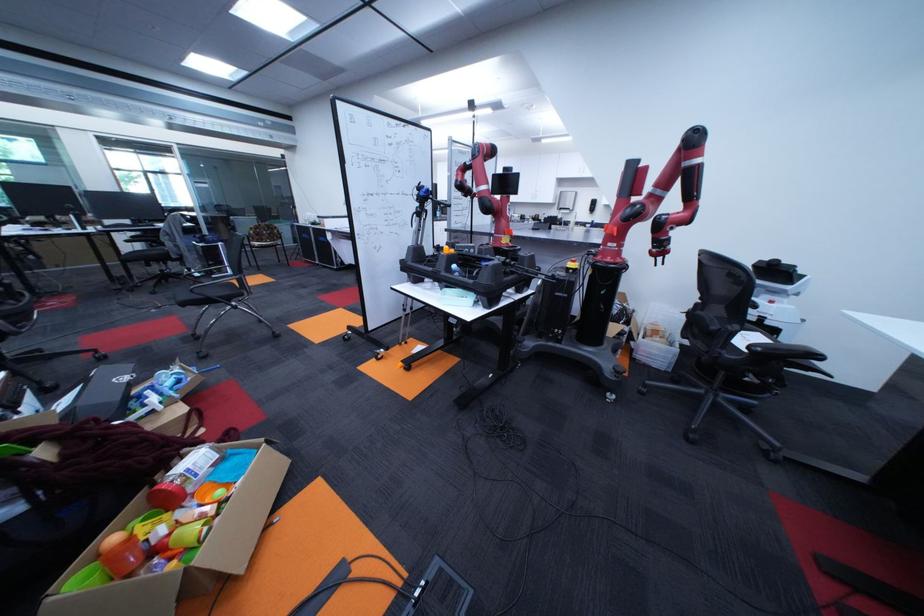
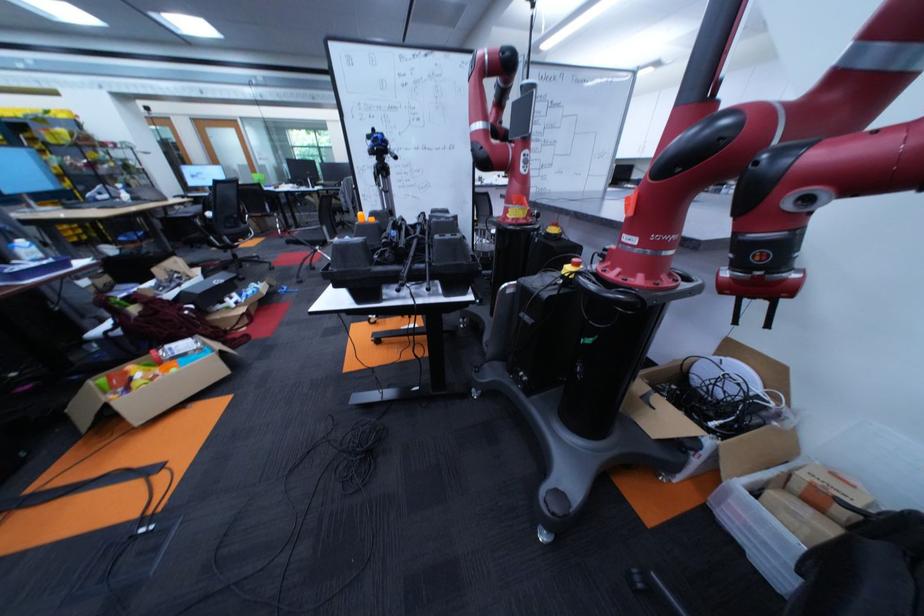
Where in the second image is the point corresponding to (210,461) from the first image?

(198, 345)